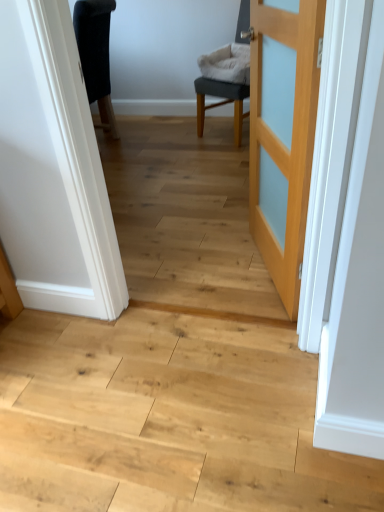
I want to click on free location to the left of gray fabric chair at center, so click(x=180, y=141).